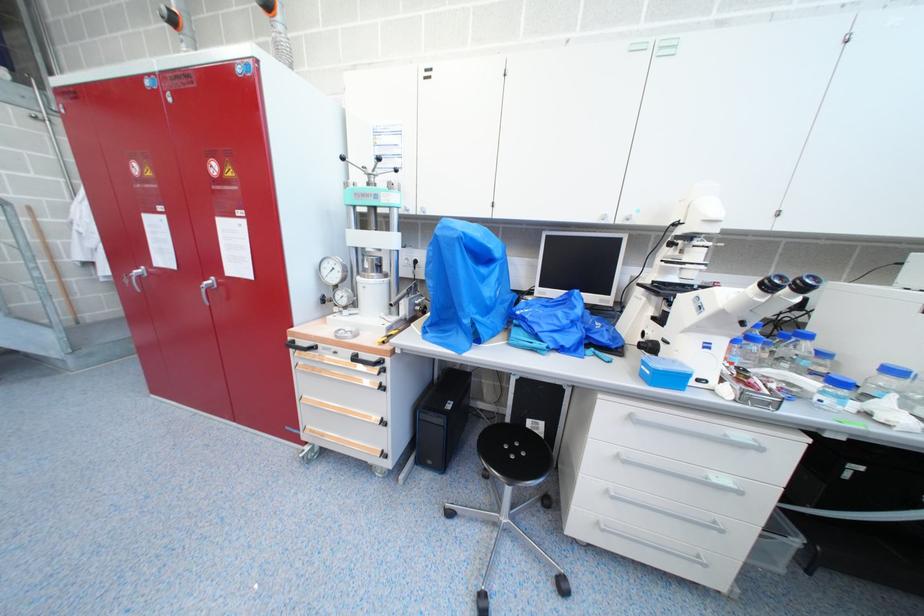
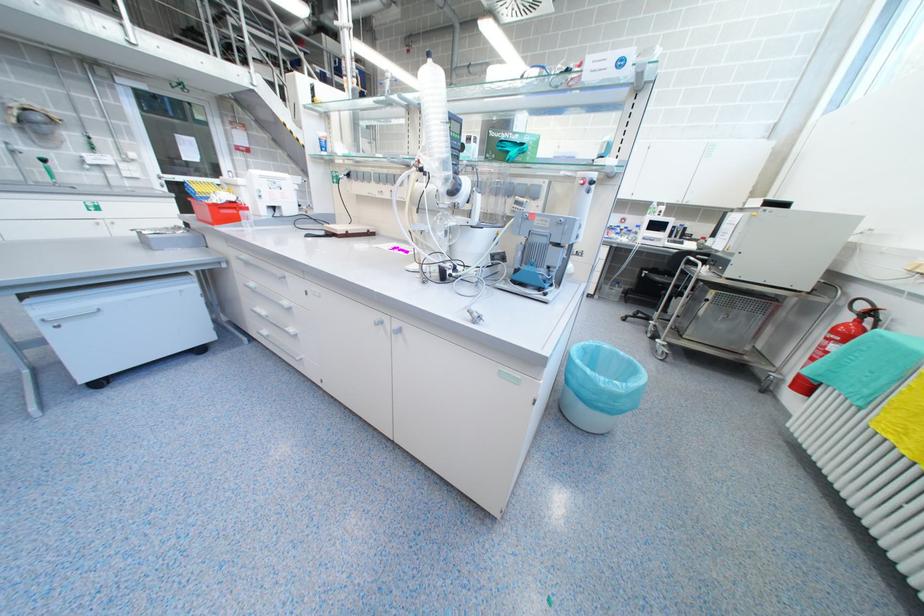
Question: What movement of the cameraman would produce the second image?

Choices:
 (A) Left
 (B) Right
 (C) Forward
 (D) Backward

Answer: (D)